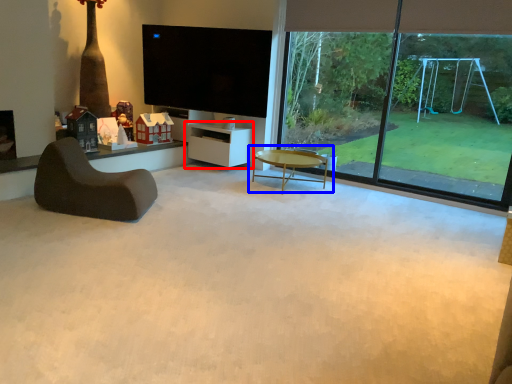
Question: Among these objects, which one is nearest to the camera, shelf (highlighted by a red box) or coffee table (highlighted by a blue box)?

Choices:
 (A) shelf
 (B) coffee table

Answer: (B)